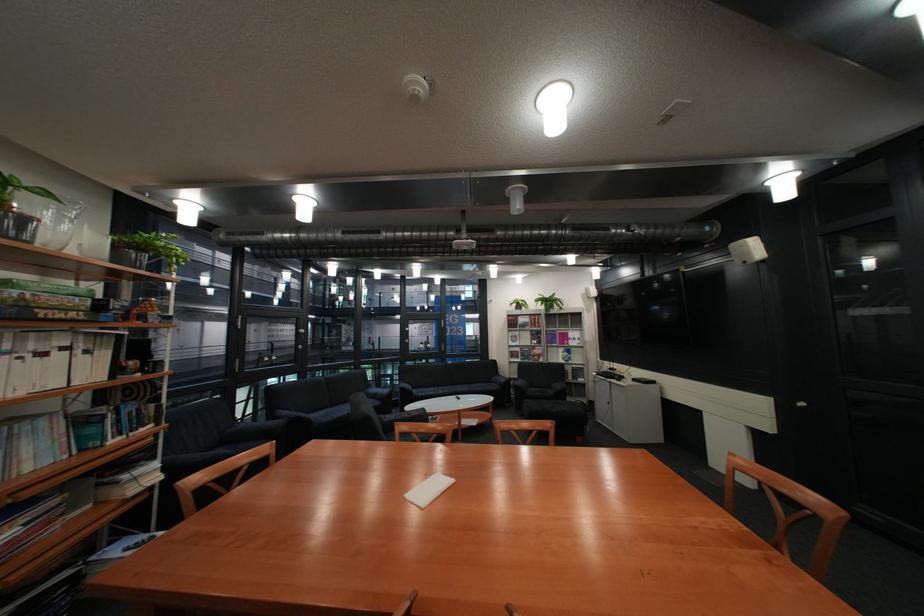
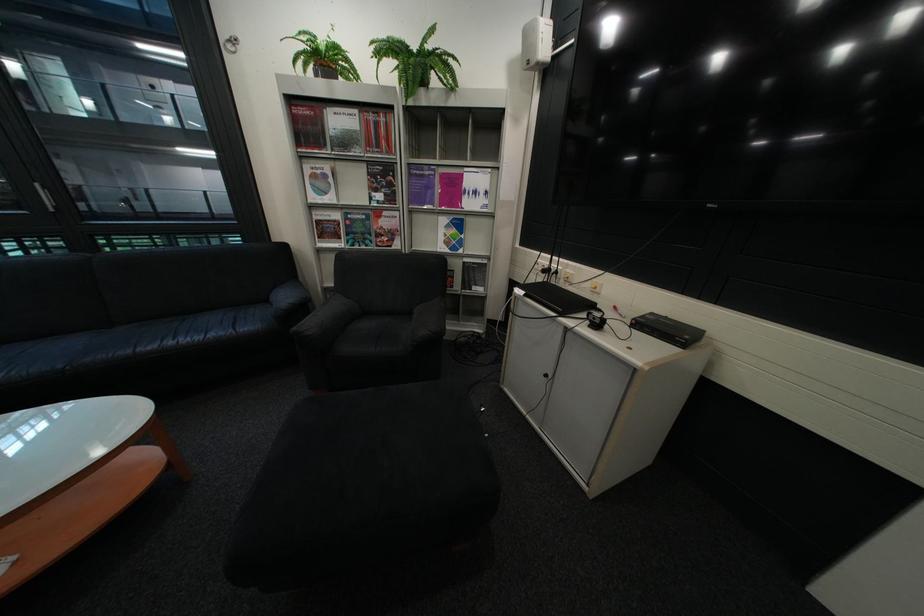
The point at (x=563, y=296) is marked in the first image. Where is the corresponding point in the second image?

(430, 46)